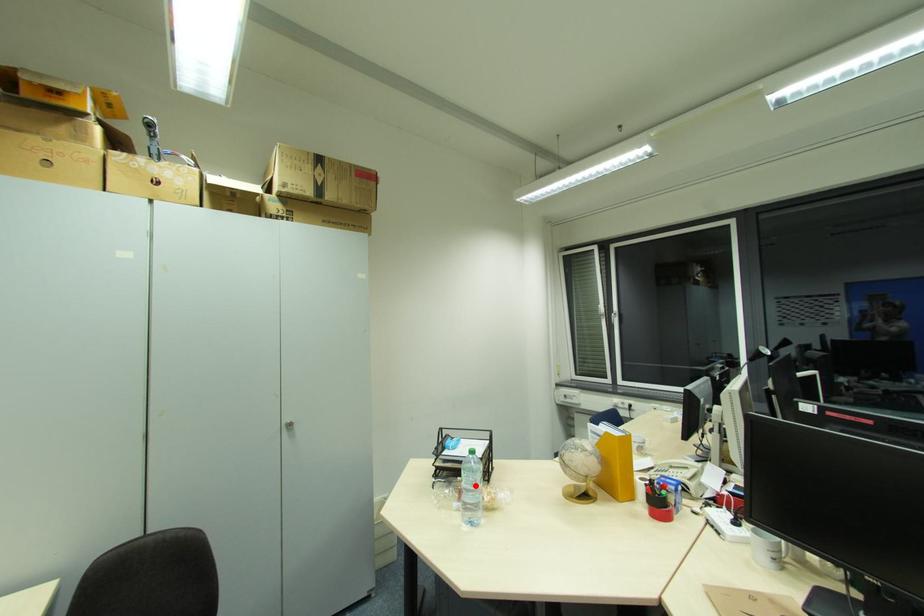
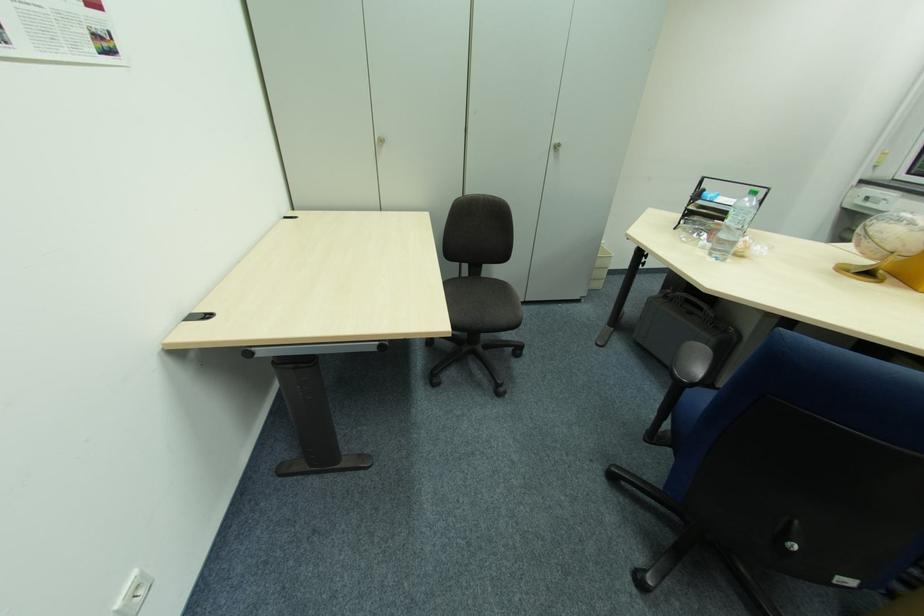
Question: I am providing you with two images of the same scene from different viewpoints. In image1, a red point is highlighted. Considering the same 3D point in image2, which of the following is correct?

Choices:
 (A) It is closer
 (B) It is farther

Answer: (A)